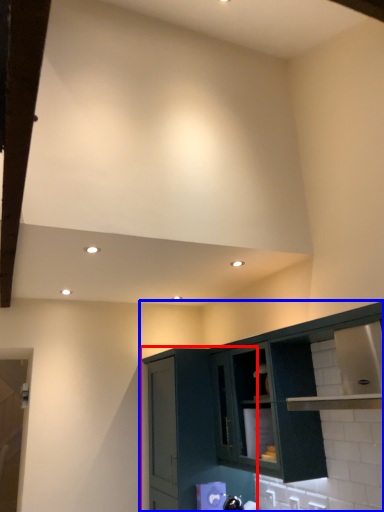
Question: Which object is closer to the camera taking this photo, cabinetry (highlighted by a red box) or cabinetry (highlighted by a blue box)?

Choices:
 (A) cabinetry
 (B) cabinetry

Answer: (B)